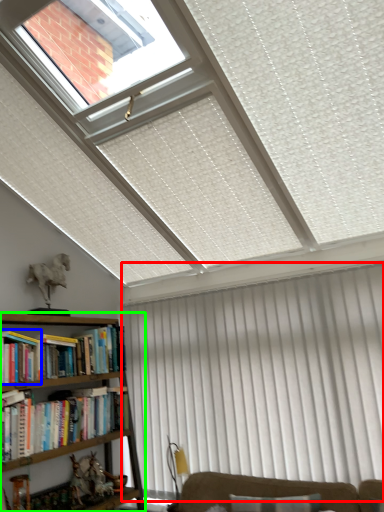
Question: Which object is positioned closest to curtain (highlighted by a red box)? Select from book (highlighted by a blue box) and bookcase (highlighted by a green box).

Choices:
 (A) book
 (B) bookcase

Answer: (B)